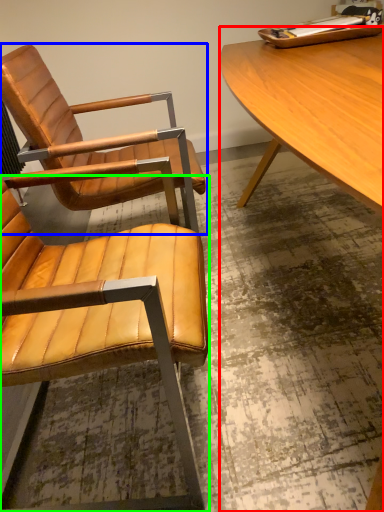
Question: Which object is positioned closest to desk (highlighted by a red box)? Select from chair (highlighted by a blue box) and chair (highlighted by a green box).

Choices:
 (A) chair
 (B) chair

Answer: (A)